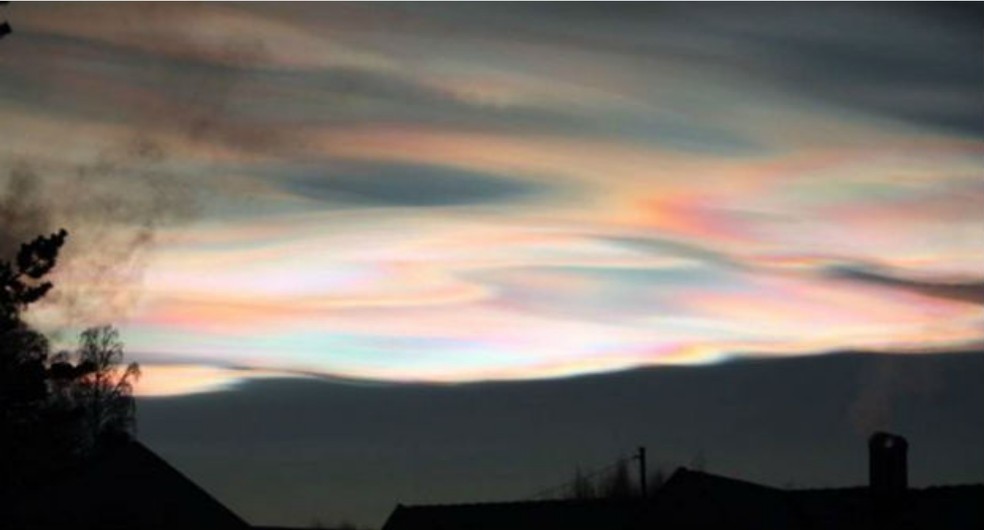
The image size is (984, 530). What are the coordinates of `chimney` in the screenshot? It's located at (892, 473).